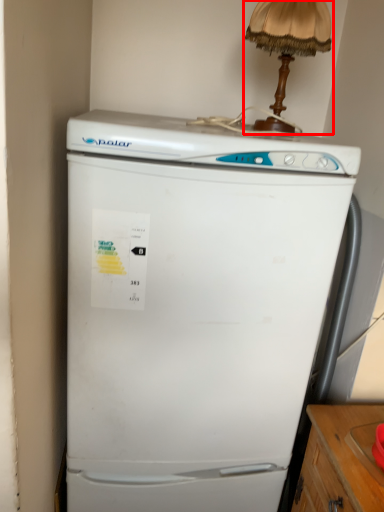
Question: Where is table lamp (annotated by the red box) located in relation to refrigerator in the image?

Choices:
 (A) right
 (B) left

Answer: (A)